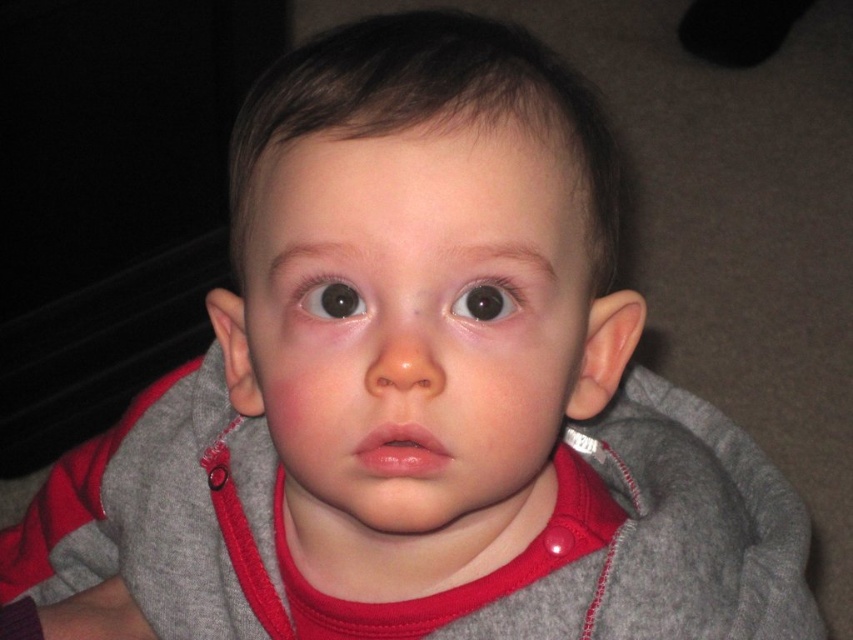
Looking at the child in the image, you notice two eyes. Which eye is closer to you, the observer, between the black glossy eye at center and the brown glossy eye at center?

The black glossy eye at center is closer to you because it is in front of the brown glossy eye at center.

The child has two eyes visible in the image. Which eye, the black glossy eye at center or the brown glossy eye at center, is located lower on the face?

The black glossy eye at center is positioned under the brown glossy eye at center, so it is located lower on the face.

Based on the scene description, can you determine which object is closer to the camera between the smooth skin face at center and the brown glossy eye at center?

The smooth skin face at center is closer to the camera than the brown glossy eye at center because the description states that the smooth skin face at center is in front of the brown glossy eye at center.